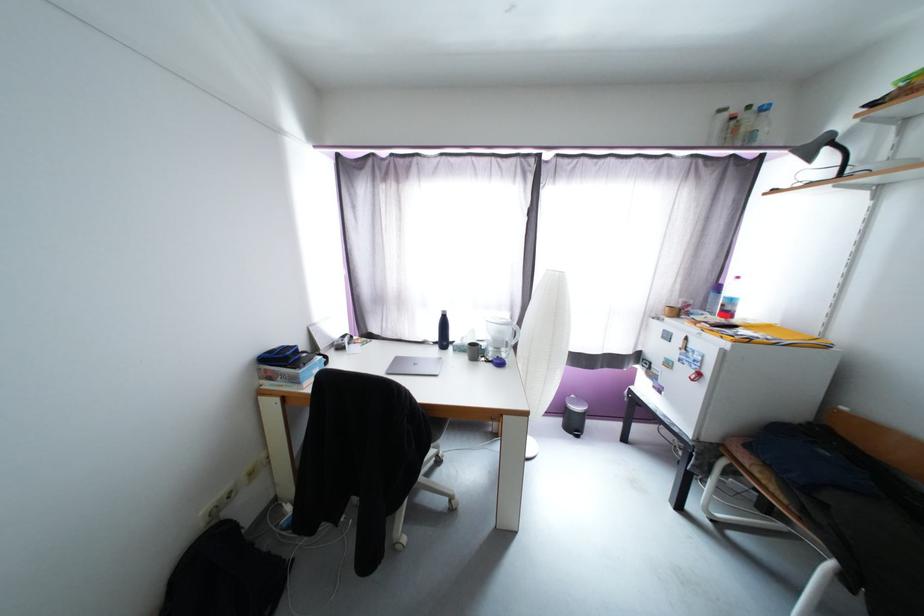
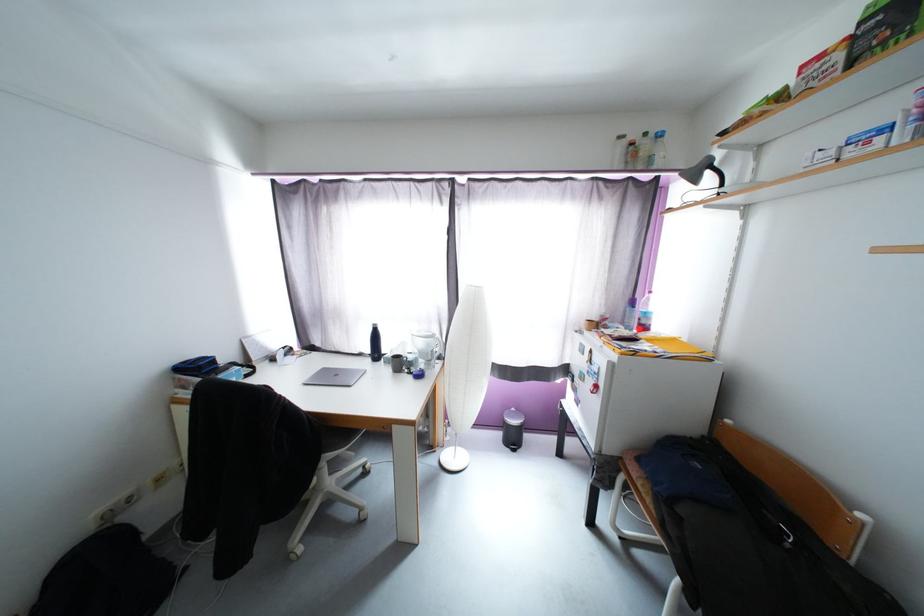
The point at (445, 317) is marked in the first image. Where is the corresponding point in the second image?

(377, 331)